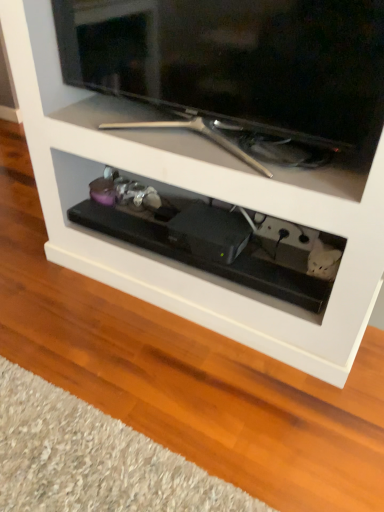
I want to click on free spot below matte black television at upper center (from a real-world perspective), so click(191, 144).